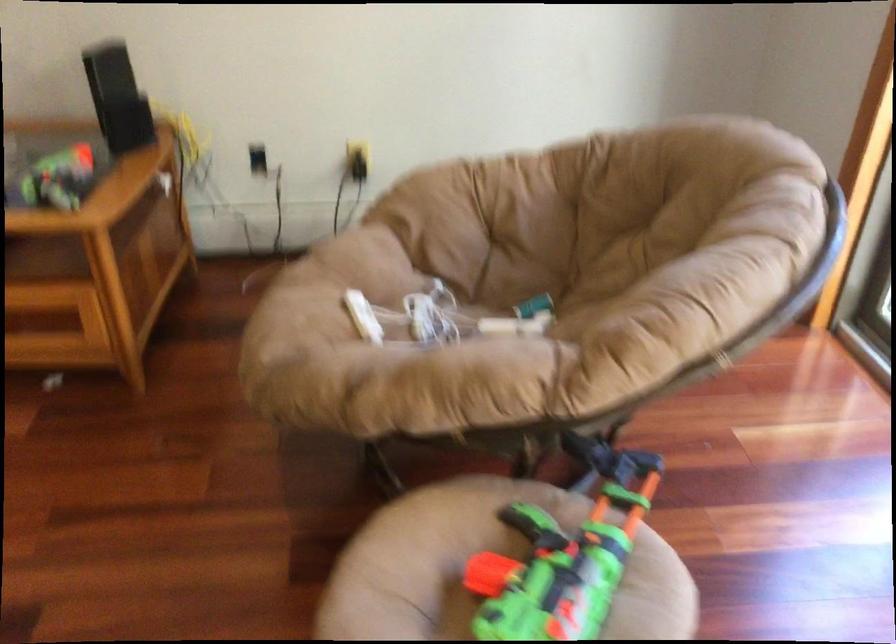
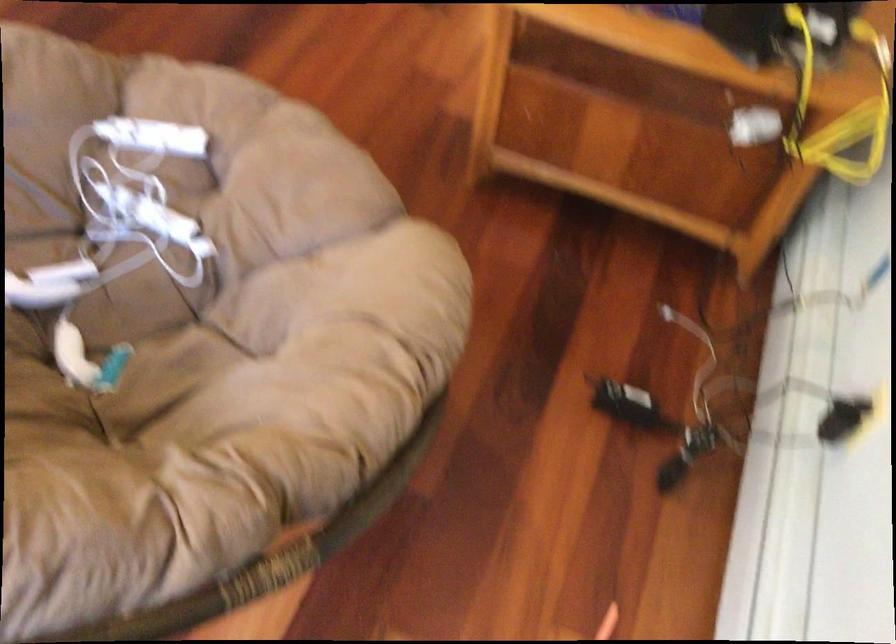
Find the pixel in the second image that matches (x=400, y=308) in the first image.

(181, 205)